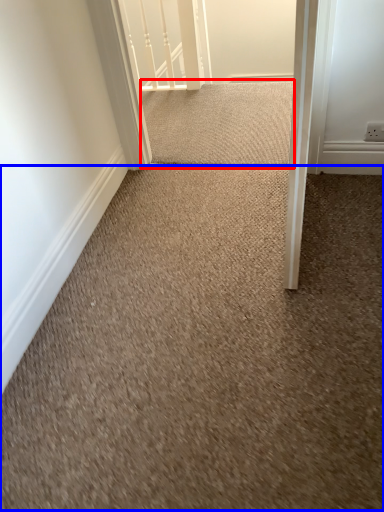
Question: Which of the following is the closest to the observer, doormat (highlighted by a red box) or granite (highlighted by a blue box)?

Choices:
 (A) doormat
 (B) granite

Answer: (B)